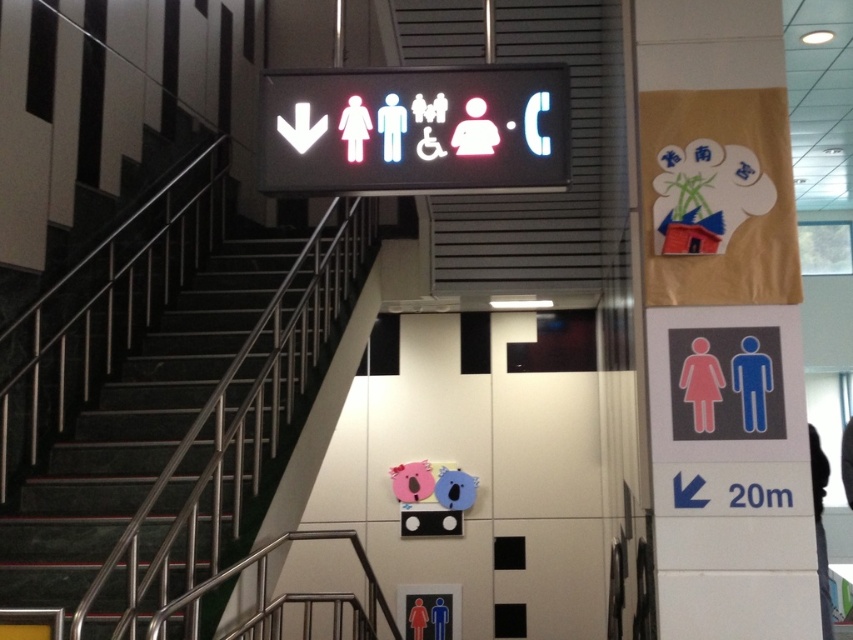
Question: Which of the following is the closest to the observer?

Choices:
 (A) (289, 74)
 (B) (108, 595)

Answer: (A)

Question: Observing the image, what is the correct spatial positioning of black marble stairs at left in reference to white plastic sign at center?

Choices:
 (A) above
 (B) below

Answer: (B)

Question: Is black marble stairs at left wider than white plastic sign at center?

Choices:
 (A) no
 (B) yes

Answer: (B)

Question: Which object is farther from the camera taking this photo?

Choices:
 (A) white plastic sign at center
 (B) black marble stairs at left

Answer: (A)

Question: Observing the image, what is the correct spatial positioning of black marble stairs at left in reference to white plastic sign at center?

Choices:
 (A) right
 (B) left

Answer: (B)

Question: Which of the following is the closest to the observer?

Choices:
 (A) (x=305, y=371)
 (B) (x=437, y=125)

Answer: (B)